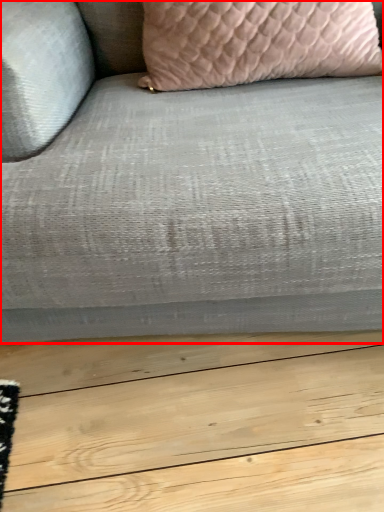
Question: In this image, where is studio couch (annotated by the red box) located relative to pillow?

Choices:
 (A) right
 (B) left

Answer: (B)